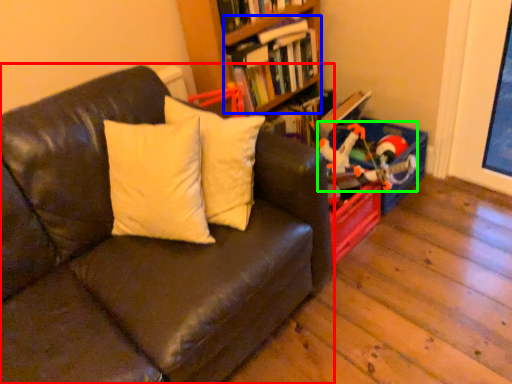
Question: Which is farther away from studio couch (highlighted by a red box)? book (highlighted by a blue box) or toy (highlighted by a green box)?

Choices:
 (A) book
 (B) toy

Answer: (A)